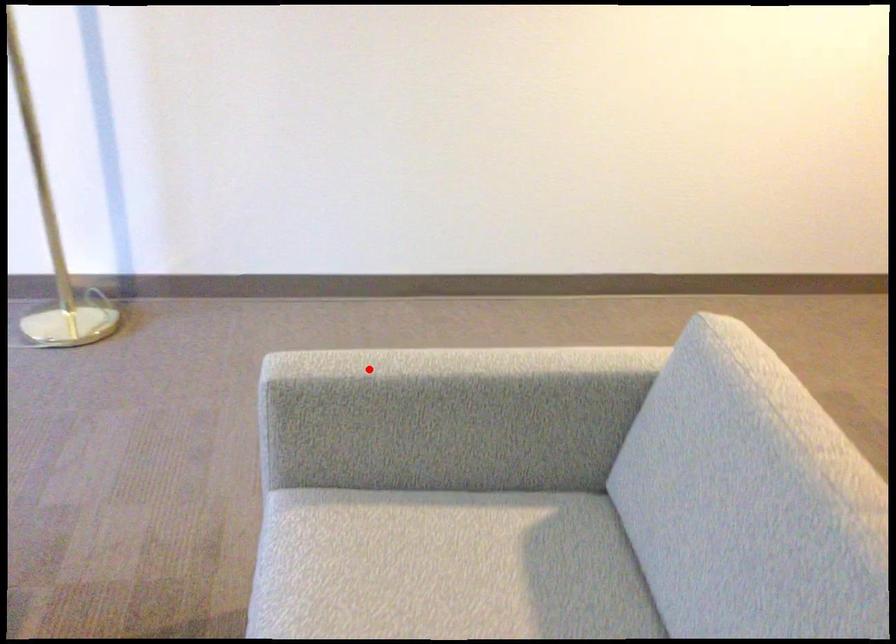
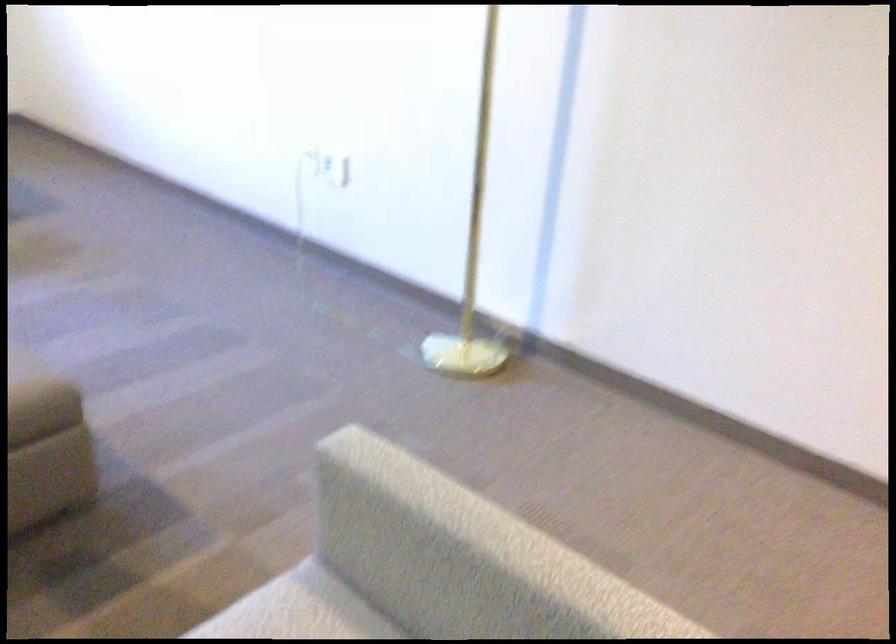
Question: A red point is marked in image1. In image2, is the corresponding 3D point closer to the camera or farther? Reply with the corresponding letter.

Choices:
 (A) The corresponding 3D point is closer.
 (B) The corresponding 3D point is farther.

Answer: (A)